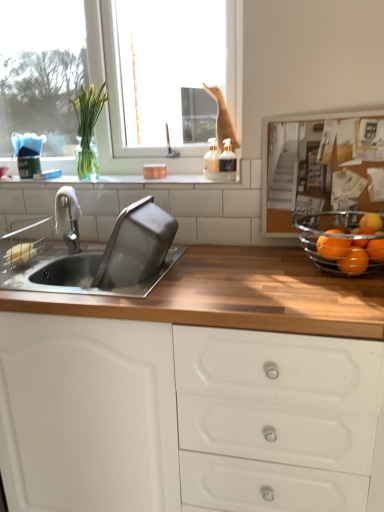
Find the location of a particular element. This screenshot has width=384, height=512. free space in front of clear glass bowl at right is located at coordinates (332, 304).